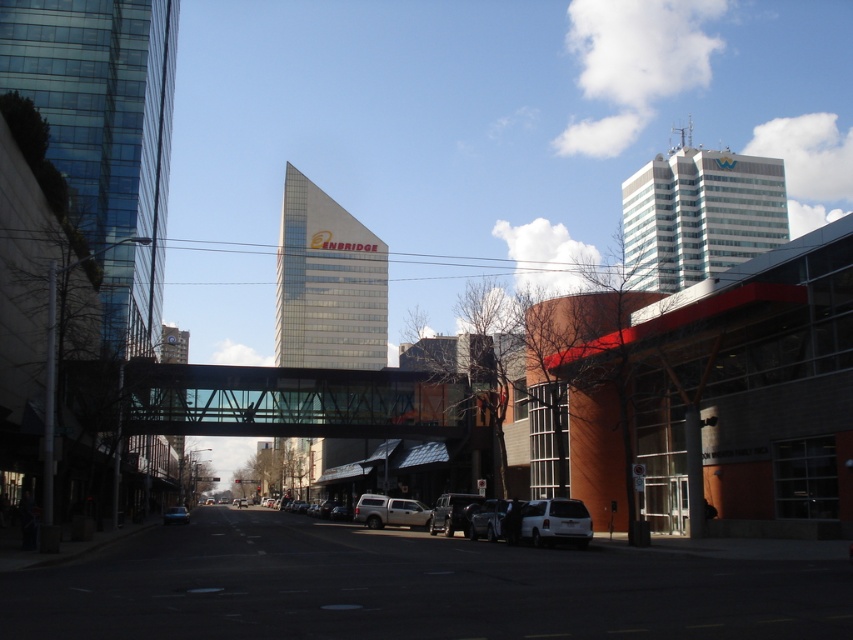
Image resolution: width=853 pixels, height=640 pixels. In order to click on metallic silver car at center in this screenshot , I will do `click(486, 518)`.

Which is behind, point (471, 538) or point (186, 520)?

The point (186, 520) is behind.

Measure the distance between metallic silver car at center and camera.

The distance of metallic silver car at center from camera is 32.18 meters.

Find the location of a particular element. The height and width of the screenshot is (640, 853). metallic silver car at center is located at coordinates (486, 518).

Which is below, white matte suv at lower center or metallic silver suv at center?

metallic silver suv at center is below.

Does point (549, 524) come in front of point (459, 496)?

That is True.

You are a GUI agent. You are given a task and a screenshot of the screen. Output one action in this format:
    pyautogui.click(x=<x>, y=<y>)
    Task: Click on the white matte suv at lower center
    The image size is (853, 640).
    Given the screenshot: What is the action you would take?
    pyautogui.click(x=555, y=522)

Image resolution: width=853 pixels, height=640 pixels. In order to click on white matte suv at lower center in this screenshot , I will do `click(555, 522)`.

Can you confirm if white matte suv at lower center is shorter than metallic silver car at center?

Yes, white matte suv at lower center is shorter than metallic silver car at center.

Where is `white matte suv at lower center`? white matte suv at lower center is located at coordinates (555, 522).